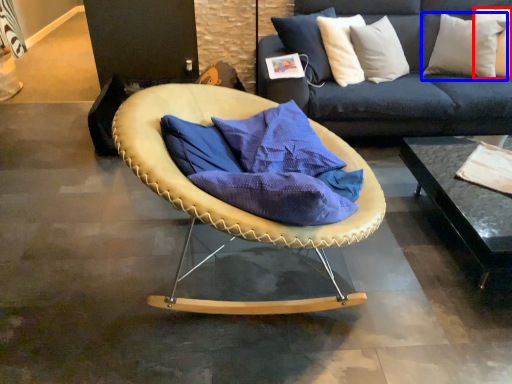
Question: Which of the following is the farthest to the observer, pillow (highlighted by a red box) or pillow (highlighted by a blue box)?

Choices:
 (A) pillow
 (B) pillow

Answer: (A)